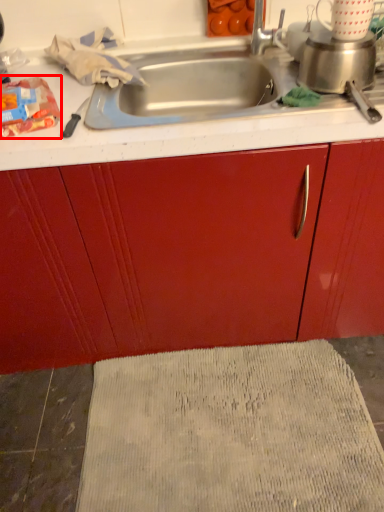
Question: From the image's perspective, what is the correct spatial positioning of food (annotated by the red box) in reference to bath mat?

Choices:
 (A) below
 (B) above

Answer: (B)